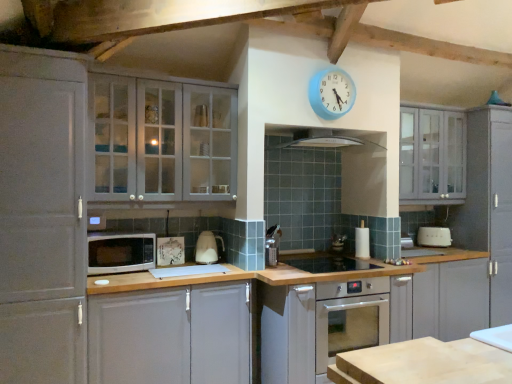
Question: Considering their positions, is white glossy electric kettle at center, acting as the 4th appliance starting from the right, located in front of or behind shiny stainless steel sink at center, the fourth appliance when ordered from back to front?

Choices:
 (A) behind
 (B) front

Answer: (A)

Question: Considering the positions of white glossy electric kettle at center, which ranks as the second appliance in front-to-back order, and shiny stainless steel sink at center, positioned as the 2th appliance in left-to-right order, in the image, is white glossy electric kettle at center, which ranks as the second appliance in front-to-back order, taller or shorter than shiny stainless steel sink at center, positioned as the 2th appliance in left-to-right order,?

Choices:
 (A) tall
 (B) short

Answer: (A)

Question: Estimate the real-world distances between objects in this image. Which object is closer to the wooden cutting board at lower right?

Choices:
 (A) white matte cabinet at lower left, placed as the second cabinetry when sorted from right to left
 (B) white plastic toaster at right, acting as the 4th appliance starting from the front
 (C) white glossy electric kettle at center, the 1th appliance in the left-to-right sequence
 (D) shiny stainless steel sink at center, positioned as the 2th appliance in left-to-right order
 (E) blue plastic clock at upper center

Answer: (A)

Question: Considering the real-world distances, which object is closest to the wooden cutting board at lower right?

Choices:
 (A) shiny stainless steel sink at center, placed as the first appliance when sorted from front to back
 (B) satin silver exhaust hood at center
 (C) metallic silver toaster at center, which is the 3th appliance from front to back
 (D) matte gray cabinet at upper right, the first cabinetry from the right
 (E) matte gray cabinet at upper left, which ranks as the 3th cabinetry in right-to-left order

Answer: (A)